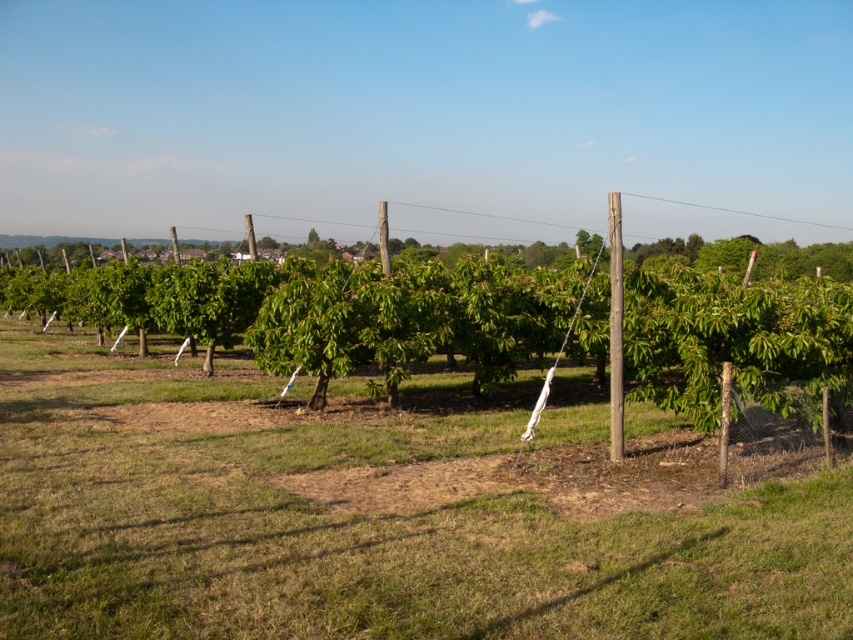
Consider the image. You are a gardener who needs to install a new trellis system for the green leafy tree at center. The trellis must be at least as tall as the tree to provide adequate support. Given the height of the smooth wooden pole at center, do you think the existing pole can support the tree?

The green leafy tree at center is much taller than the smooth wooden pole at center, so the existing pole cannot support the tree as it is shorter than the tree.

You are standing at the center of the orchard and see a point marked at coordinates (347, 314). Based on the scene description, can you determine what object this point is located on?

The point is located on the green leafy tree at center.

You are a farmer who needs to water the green leafy tree at center and the smooth wooden pole at center. If your watering can holds exactly 9 meters worth of water, can you water both objects without refilling?

The distance between the green leafy tree at center and the smooth wooden pole at center is 8.87 meters, so yes, you can water both objects without refilling your watering can since the distance is less than 9 meters.